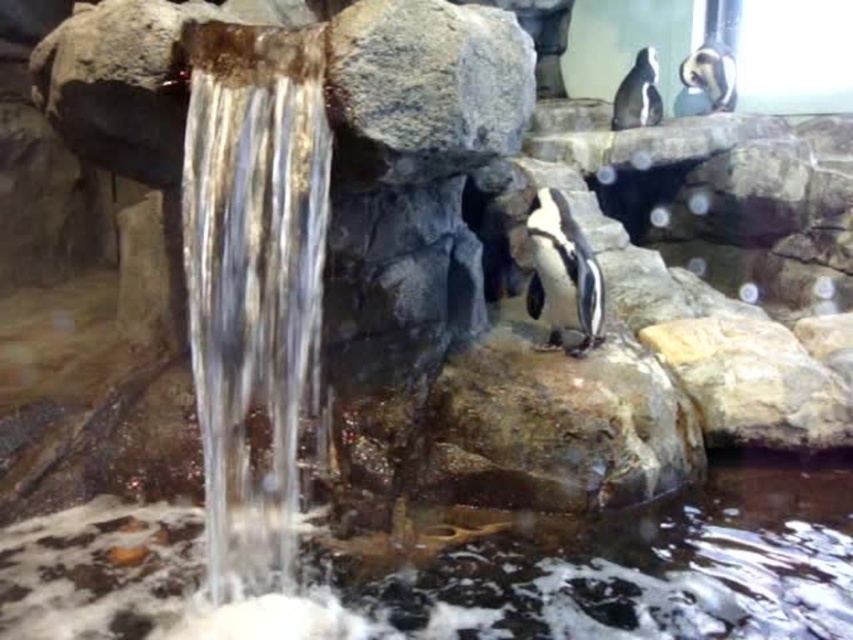
You are a zookeeper standing at the center of the exhibit. You need to place a new feeding station exactly 0.2 units to the left of the black and white penguin at upper right. Where should you place the feeding station?

The feeding station should be placed at point 0.147 minus 0.2 equals 0.147 minus 0.2 equals negative 0.053, so the coordinate would be invalid. Please place it within the exhibit boundaries.

You are a visitor at the aquarium and want to take a photo of the black glossy penguin at upper right and the clear water at center. Which object should you focus on first if you want to capture both in the same frame?

You should focus on the black glossy penguin at upper right first because the clear water at center is located below it, allowing both to be captured in the same frame by adjusting the camera angle to include the lower area.